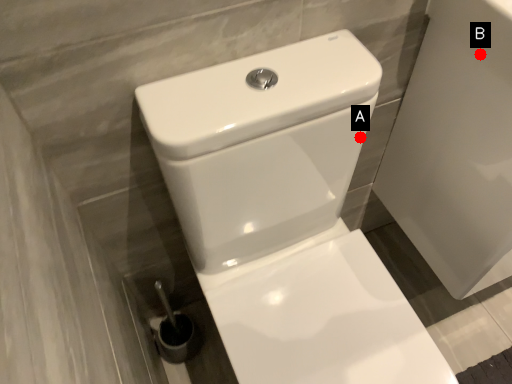
Question: Two points are circled on the image, labeled by A and B beside each circle. Which point appears closest to the camera in this image?

Choices:
 (A) A is closer
 (B) B is closer

Answer: (B)